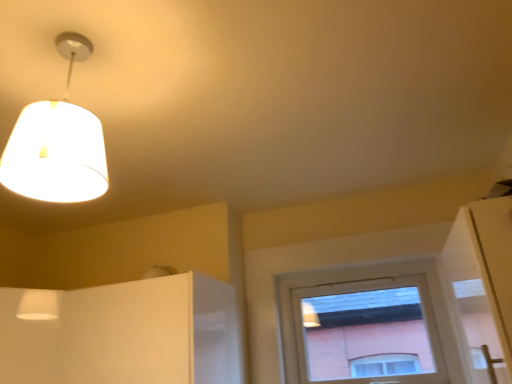
Question: From the image's perspective, is white glossy cabinet at lower left over matte white window at center?

Choices:
 (A) no
 (B) yes

Answer: (B)

Question: From a real-world perspective, is white glossy cabinet at lower left physically below matte white window at center?

Choices:
 (A) no
 (B) yes

Answer: (B)

Question: Is white glossy cabinet at lower left oriented towards matte white window at center?

Choices:
 (A) yes
 (B) no

Answer: (B)

Question: Is white glossy cabinet at lower left behind matte white window at center?

Choices:
 (A) no
 (B) yes

Answer: (A)

Question: From a real-world perspective, does white glossy cabinet at lower left stand above matte white window at center?

Choices:
 (A) yes
 (B) no

Answer: (B)

Question: Can you see white glossy cabinet at lower left touching matte white window at center?

Choices:
 (A) no
 (B) yes

Answer: (A)

Question: Is matte white window at center to the right of white glossy cabinet at lower left from the viewer's perspective?

Choices:
 (A) no
 (B) yes

Answer: (B)

Question: Is matte white window at center positioned before white glossy cabinet at lower left?

Choices:
 (A) no
 (B) yes

Answer: (A)

Question: From a real-world perspective, is matte white window at center located higher than white glossy cabinet at lower left?

Choices:
 (A) no
 (B) yes

Answer: (B)

Question: Is matte white window at center positioned beyond the bounds of white glossy cabinet at lower left?

Choices:
 (A) no
 (B) yes

Answer: (B)

Question: Is matte white window at center placed right next to white glossy cabinet at lower left?

Choices:
 (A) yes
 (B) no

Answer: (B)

Question: From the image's perspective, is matte white window at center below white glossy cabinet at lower left?

Choices:
 (A) no
 (B) yes

Answer: (B)

Question: Does white fabric lampshade at upper left lie in front of white glossy cabinet at lower left?

Choices:
 (A) yes
 (B) no

Answer: (A)